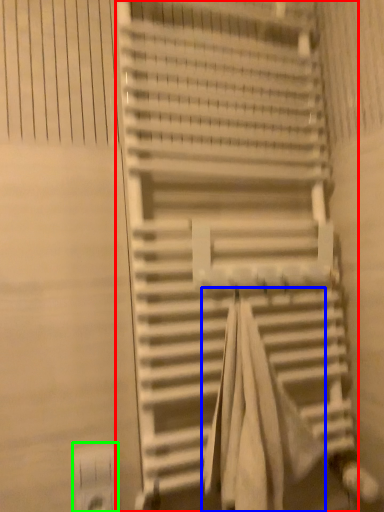
Question: Which object is positioned farthest from stairs (highlighted by a red box)? Select from beach towel (highlighted by a blue box) and electric outlet (highlighted by a green box).

Choices:
 (A) beach towel
 (B) electric outlet

Answer: (B)